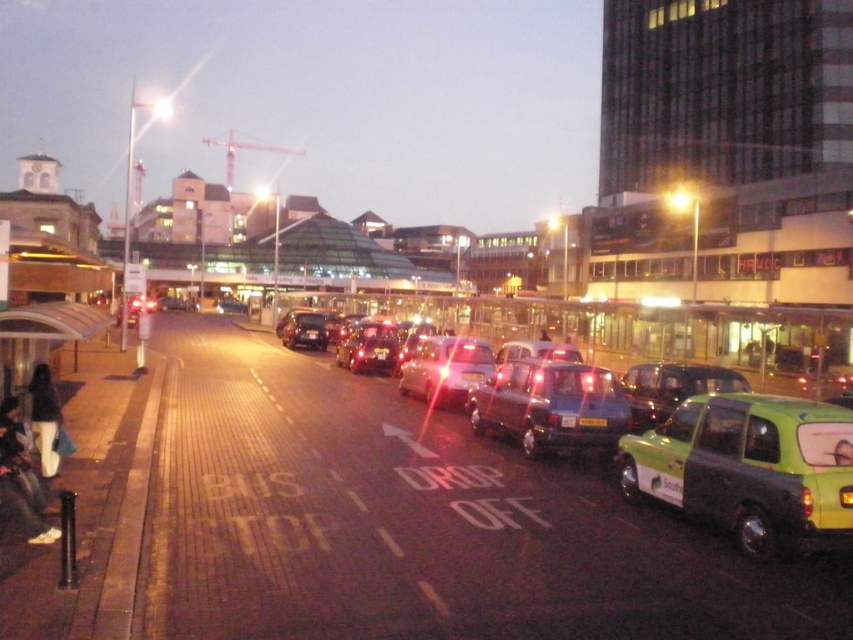
You are a driver who needs to park your car in the drop off area. You see two taxis at the center of the scene, a metallic green taxi at center and a green matte taxi at center. Which one takes up less space in the parking spot?

The metallic green taxi at center is smaller than the green matte taxi at center, so it takes up less space in the parking spot.

You are a pedestrian standing at the bus stop and want to hail a taxi. There are two taxis at center, a metallic green taxi at center and a green matte taxi at center. Which one is closer to your left side?

The metallic green taxi at center is positioned on the left side of green matte taxi at center, so it is closer to your left side.

You are a delivery person who needs to unload a package between the metallic blue taxi at center and the green matte taxi at center. The package requires a space of 2 meters to be safely placed. Is there enough space between them?

The metallic blue taxi at center is 1.88 meters from the green matte taxi at center. Since the required space is 2 meters, there isn not enough space between them to safely place the package.